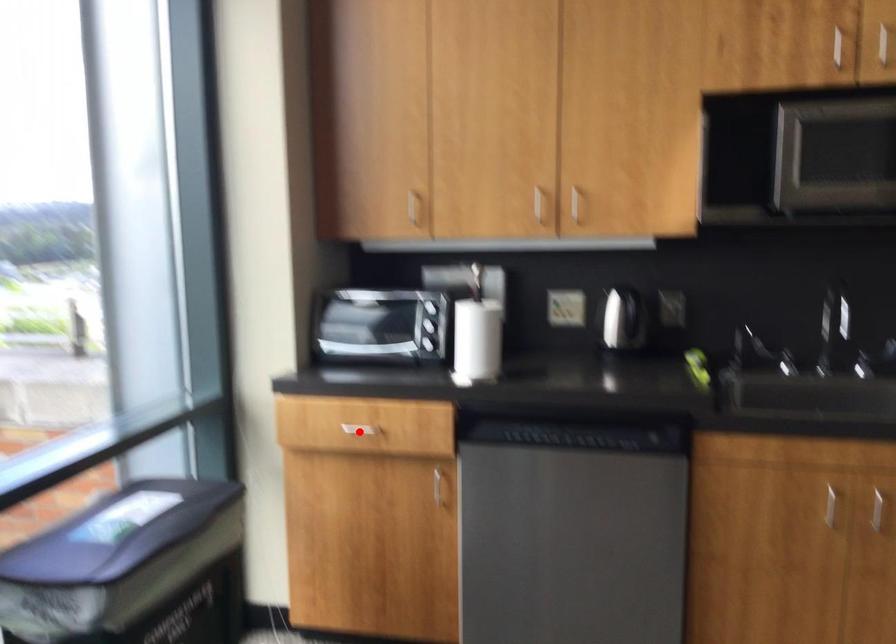
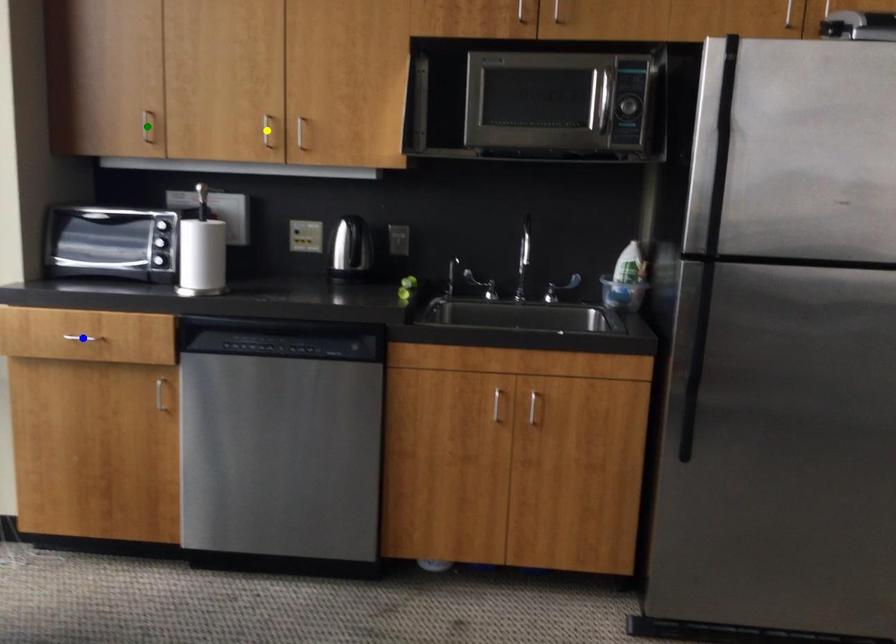
Question: I am providing you with two images of the same scene from different viewpoints. A red point is marked on the first image. You are given multiple points on the second image. Which mark in image 2 goes with the point in image 1?

Choices:
 (A) yellow point
 (B) green point
 (C) blue point

Answer: (C)